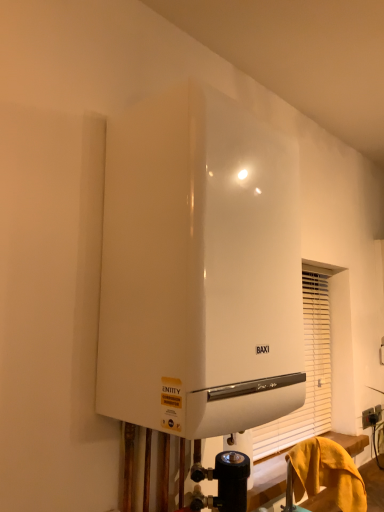
Question: From a real-world perspective, relative to yellow fabric at lower right, is white glossy boiler at upper center vertically above or below?

Choices:
 (A) above
 (B) below

Answer: (A)

Question: From the image's perspective, relative to yellow fabric at lower right, is white glossy boiler at upper center above or below?

Choices:
 (A) below
 (B) above

Answer: (B)

Question: Considering the real-world distances, which object is closest to the white glossy boiler at upper center?

Choices:
 (A) yellow fabric at lower right
 (B) black plastic electric outlet at lower right

Answer: (A)

Question: Which of these objects is positioned farthest from the white glossy boiler at upper center?

Choices:
 (A) black plastic electric outlet at lower right
 (B) yellow fabric at lower right

Answer: (A)